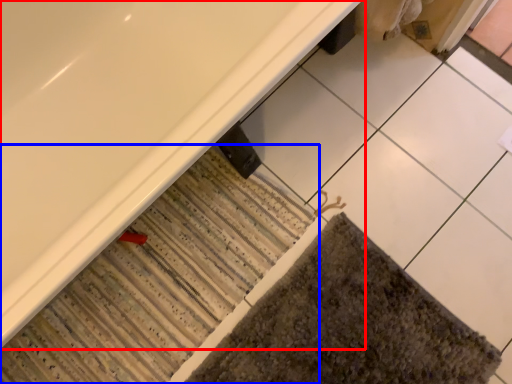
Question: Which object is further to the camera taking this photo, bathtub (highlighted by a red box) or bath mat (highlighted by a blue box)?

Choices:
 (A) bathtub
 (B) bath mat

Answer: (B)